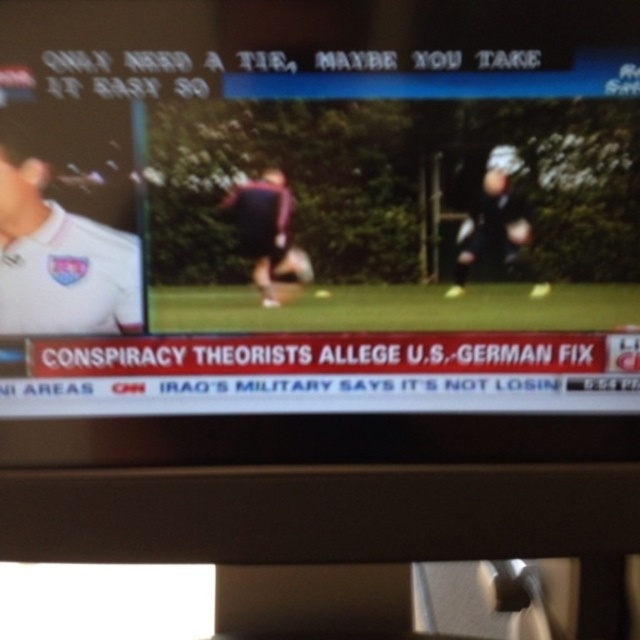
Consider the image. Between maroon jersey at center and dark blue uniform at right, which one appears on the left side from the viewer's perspective?

maroon jersey at center

Between maroon jersey at center and dark blue uniform at right, which one is positioned lower?

Positioned lower is maroon jersey at center.

In the scene shown: Measure the distance between point (275, 224) and camera.

Point (275, 224) and camera are 18.04 inches apart.

The height and width of the screenshot is (640, 640). I want to click on maroon jersey at center, so click(264, 228).

How far apart are white matte shirt at left and dark blue uniform at right?

white matte shirt at left is 8.50 inches away from dark blue uniform at right.

Who is higher up, white matte shirt at left or dark blue uniform at right?

dark blue uniform at right is above.

Is point (92, 228) positioned before point (509, 216)?

Yes.

Image resolution: width=640 pixels, height=640 pixels. I want to click on white matte shirt at left, so click(58, 257).

Which is in front, point (113, 280) or point (220, 205)?

Point (220, 205) is in front.

Does white matte shirt at left appear over maroon jersey at center?

No.

Identify the location of white matte shirt at left. This screenshot has width=640, height=640. (58, 257).

Where is `white matte shirt at left`? white matte shirt at left is located at coordinates (58, 257).